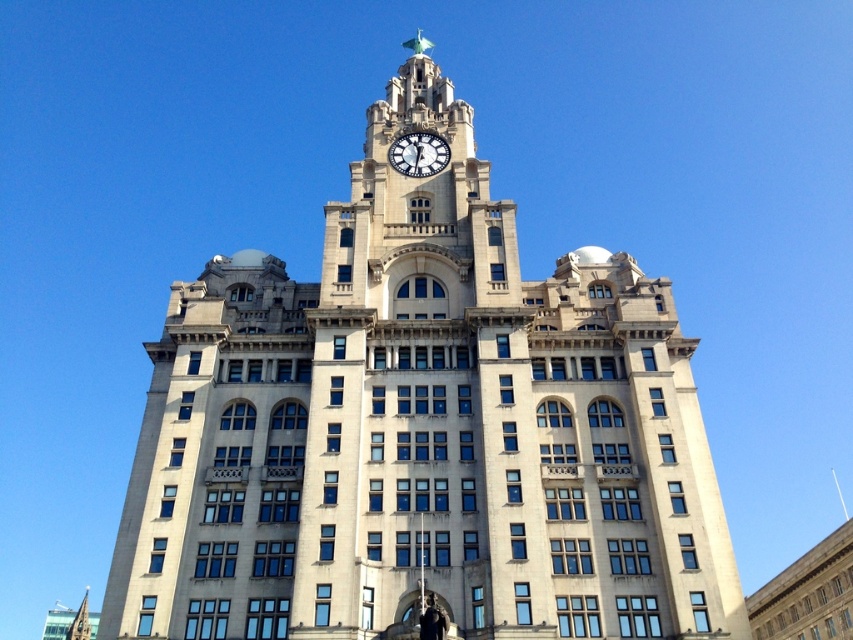
You are a window cleaner who needs to clean both the white stone clock tower at center and the white marble clock at center. Which one should you clean first if you want to start from the lower one?

The white marble clock at center should be cleaned first because it is located lower than the white stone clock tower at center, which is positioned above it.

You are standing in front of the grand historic building and want to locate the point at coordinates [422,429]. Based on the scene description, where would this point be located?

The point at coordinates [422,429] is located on the white stone clock tower at center.

You are standing in front of a historic building and want to take a photo of the white stone clock tower at center. If your camera can focus on objects up to 40 meters away, will it be able to capture the tower clearly?

The white stone clock tower at center is 39.08 meters away from the camera, so yes, the camera can focus on it clearly since the distance is within its 40 meters range.